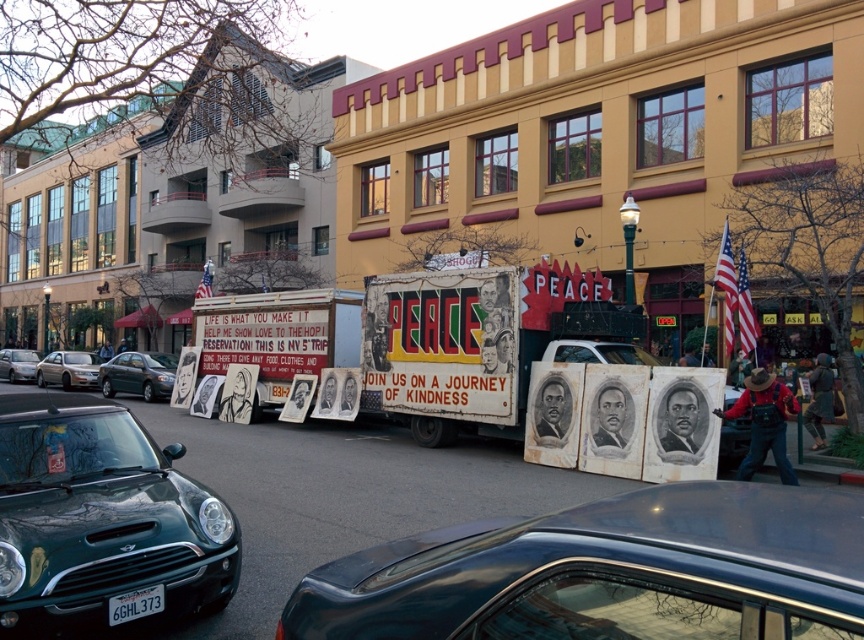
Question: Considering the real-world distances, which object is farthest from the metallic blue car at center?

Choices:
 (A) white cardboard truck at center
 (B) white plastic license plate at lower left
 (C) metallic green car at left
 (D) green matte sedan at left

Answer: (C)

Question: In this image, where is green matte sedan at left located relative to white plastic license plate at lower left?

Choices:
 (A) above
 (B) below

Answer: (B)

Question: Is the position of green matte sedan at left less distant than that of metallic green car at left?

Choices:
 (A) no
 (B) yes

Answer: (B)

Question: Which object appears farthest from the camera in this image?

Choices:
 (A) white plastic license plate at lower left
 (B) metallic silver sedan at center-left
 (C) metallic green car at left

Answer: (C)

Question: Considering the relative positions of shiny dark green car at lower left and white plastic license plate at lower left in the image provided, where is shiny dark green car at lower left located with respect to white plastic license plate at lower left?

Choices:
 (A) right
 (B) left

Answer: (B)

Question: Which of the following is the closest to the observer?

Choices:
 (A) (99, 365)
 (B) (0, 352)
 (C) (159, 589)

Answer: (C)